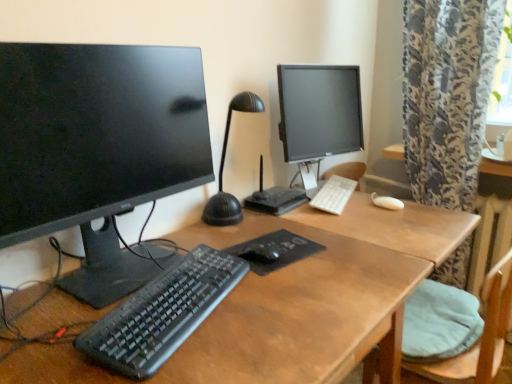
You are a GUI agent. You are given a task and a screenshot of the screen. Output one action in this format:
    pyautogui.click(x=<x>, y=<y>)
    Task: Click on the vacant area that is in front of black textured mousepad at center
    The image size is (512, 384).
    Given the screenshot: What is the action you would take?
    pyautogui.click(x=291, y=284)